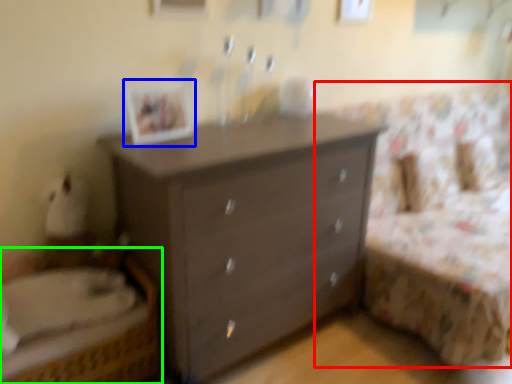
Question: Which object is the closest to the bed frame (highlighted by a red box)? Choose among these: picture frame (highlighted by a blue box) or bed (highlighted by a green box).

Choices:
 (A) picture frame
 (B) bed

Answer: (A)